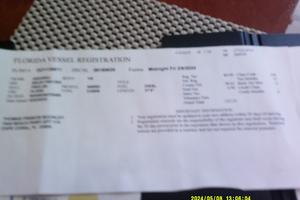
You are a GUI agent. You are given a task and a screenshot of the screen. Output one action in this format:
    pyautogui.click(x=<x>, y=<y>)
    Task: Click on the piece of paper
    This screenshot has width=300, height=200.
    Given the screenshot: What is the action you would take?
    pyautogui.click(x=97, y=165)